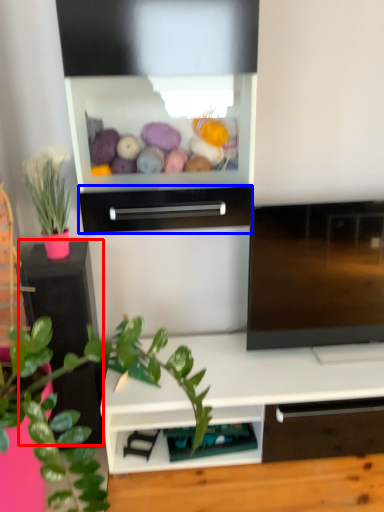
Question: Which of the following is the farthest to the observer, table (highlighted by a red box) or drawer (highlighted by a blue box)?

Choices:
 (A) table
 (B) drawer

Answer: (A)